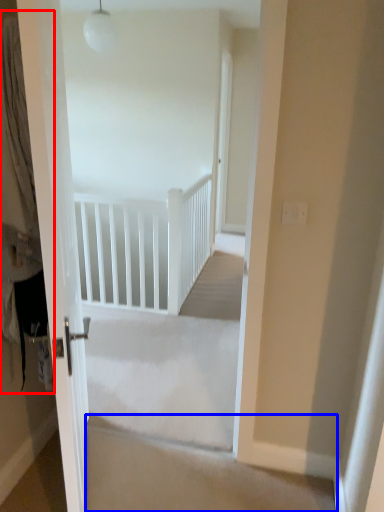
Question: Which point is closer to the camera, curtain (highlighted by a red box) or stairwell (highlighted by a blue box)?

Choices:
 (A) curtain
 (B) stairwell

Answer: (A)